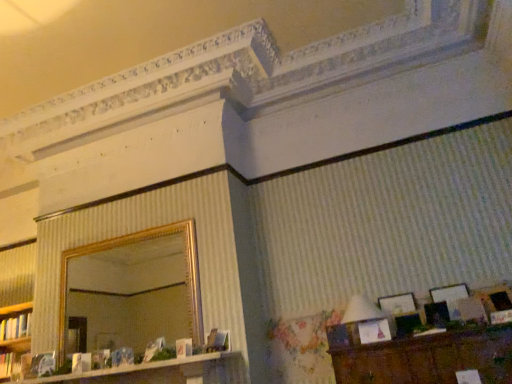
Question: Considering their positions, is matte white book at lower left, the 2th book from the top, located in front of or behind gold-framed mirror at upper center?

Choices:
 (A) behind
 (B) front

Answer: (A)

Question: Do you think matte white book at lower left, the 2th book from the top, is within gold-framed mirror at upper center, or outside of it?

Choices:
 (A) inside
 (B) outside

Answer: (B)

Question: Which object is positioned farthest from the white glossy dresser at lower left?

Choices:
 (A) wooden picture frame at lower right, arranged as the 3th picture frame when viewed from the left
 (B) matte black picture frame at lower right, arranged as the 2th picture frame when viewed from the right
 (C) white fabric lampshade at right
 (D) white paper book at left, the first book in the top-to-bottom sequence
 (E) brown wooden vanity at lower right

Answer: (A)

Question: Which object is positioned farthest from the matte black picture frame at lower right, arranged as the 2th picture frame when viewed from the left?

Choices:
 (A) white paper book at left, the first book in the top-to-bottom sequence
 (B) white glossy dresser at lower left
 (C) matte white book at lower left, the 2th book from the top
 (D) gold-framed mirror at upper center
 (E) wooden picture frame at lower right, arranged as the 3th picture frame when viewed from the left

Answer: (A)